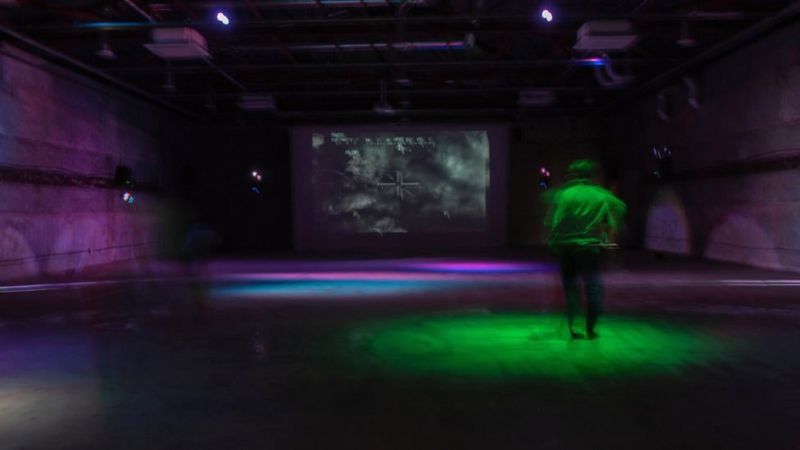
Identify the location of ceiling. (422, 14).